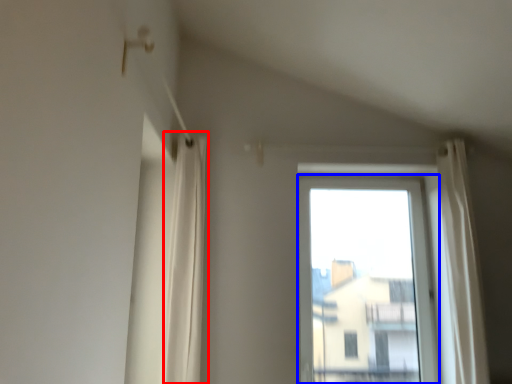
Question: Which point is closer to the camera, shower curtain (highlighted by a red box) or window (highlighted by a blue box)?

Choices:
 (A) shower curtain
 (B) window

Answer: (A)